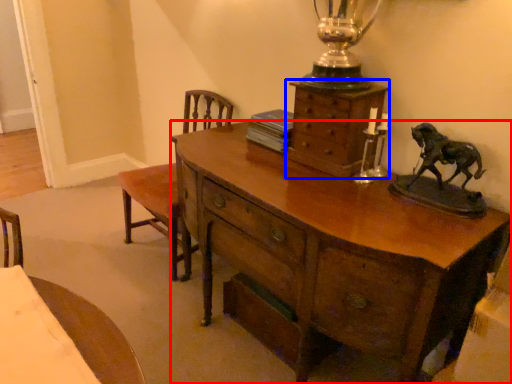
Question: Among these objects, which one is farthest to the camera, desk (highlighted by a red box) or chest of drawers (highlighted by a blue box)?

Choices:
 (A) desk
 (B) chest of drawers

Answer: (B)